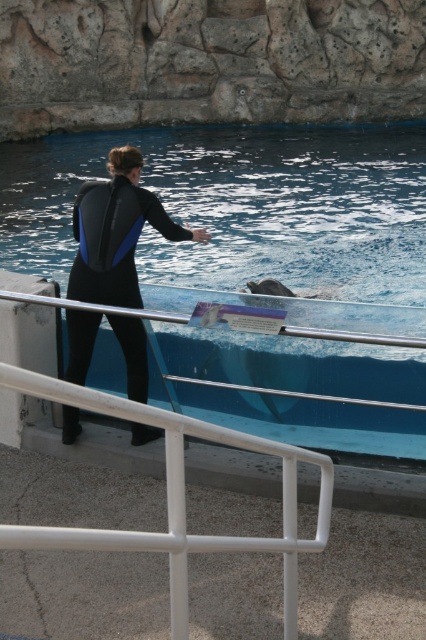
Does blue smooth pool at center have a greater width compared to black neoprene wetsuit at center?

Yes, blue smooth pool at center is wider than black neoprene wetsuit at center.

Is blue smooth pool at center bigger than black neoprene wetsuit at center?

Indeed, blue smooth pool at center has a larger size compared to black neoprene wetsuit at center.

Who is more forward, (22, 216) or (91, 272)?

Point (91, 272) is more forward.

Identify the location of blue smooth pool at center. The height and width of the screenshot is (640, 426). (245, 214).